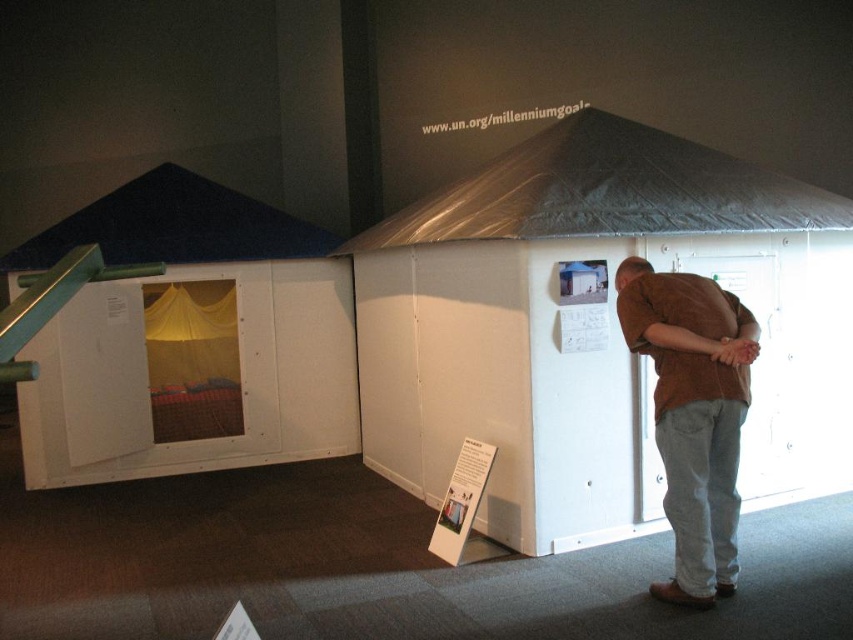
You are a relief worker assessing the shelters. You notice the brown cotton shirt at center and the dark blue fabric canopy at upper left. Which object is taller?

The brown cotton shirt at center is taller than the dark blue fabric canopy at upper left according to the description.

You are a relief worker setting up supplies in the indoor area. You need to place a heavy box that requires 1.2 meters of clearance above it. The white matte tent at center and dark blue fabric canopy at upper left are in the way. Which object is the main obstacle for the box?

The dark blue fabric canopy at upper left is the main obstacle because it is above the white matte tent at center, so the box would hit it first if placed there.

You are a relief worker trying to set up tents in a disaster area. You have a white matte tent at left and a transparent plastic canopy at upper center. Which object is positioned further to the east? Please answer based on the scene description.

The white matte tent at left is positioned to the left of the transparent plastic canopy at upper center. Since the scene is viewed from the front, the left side corresponds to the east direction. Therefore, the white matte tent at left is further to the east.